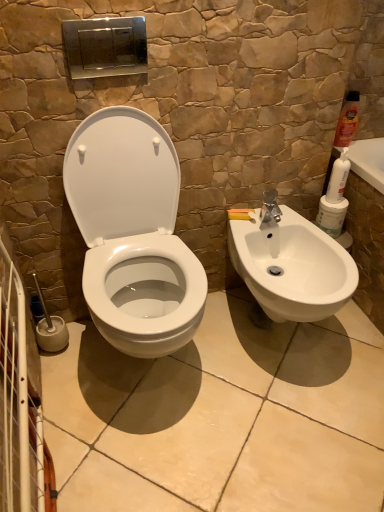
Question: From the image's perspective, does matte orange bottle at upper right, which is the first cleaning product from top to bottom, appear higher than white glossy toilet at center?

Choices:
 (A) yes
 (B) no

Answer: (A)

Question: Is matte orange bottle at upper right, the 2th cleaning product when ordered from bottom to top, at the left side of white glossy toilet at center?

Choices:
 (A) no
 (B) yes

Answer: (A)

Question: From a real-world perspective, is matte orange bottle at upper right, the 2th cleaning product when ordered from bottom to top, positioned over white glossy toilet at center based on gravity?

Choices:
 (A) no
 (B) yes

Answer: (B)

Question: From a real-world perspective, is matte orange bottle at upper right, the 1th cleaning product viewed from the right, below white glossy toilet at center?

Choices:
 (A) yes
 (B) no

Answer: (B)

Question: Is matte orange bottle at upper right, the 2th cleaning product when ordered from bottom to top, aimed at white glossy toilet at center?

Choices:
 (A) no
 (B) yes

Answer: (A)

Question: Does matte orange bottle at upper right, which is the first cleaning product from top to bottom, touch white glossy toilet at center?

Choices:
 (A) no
 (B) yes

Answer: (A)

Question: Can we say white matte cleaning product at right, arranged as the first cleaning product when viewed from the left, lies outside matte orange bottle at upper right, which is the first cleaning product from top to bottom?

Choices:
 (A) yes
 (B) no

Answer: (A)

Question: From a real-world perspective, does white matte cleaning product at right, the 2th cleaning product viewed from the right, sit lower than matte orange bottle at upper right, the second cleaning product viewed from the left?

Choices:
 (A) yes
 (B) no

Answer: (A)

Question: Does white matte cleaning product at right, the 2th cleaning product viewed from the right, have a smaller size compared to matte orange bottle at upper right, the 2th cleaning product when ordered from bottom to top?

Choices:
 (A) no
 (B) yes

Answer: (B)

Question: Is white matte cleaning product at right, the 2th cleaning product viewed from the right, at the right side of matte orange bottle at upper right, the second cleaning product viewed from the left?

Choices:
 (A) no
 (B) yes

Answer: (A)

Question: Does white matte cleaning product at right, positioned as the 2th cleaning product in top-to-bottom order, have a greater height compared to matte orange bottle at upper right, the 2th cleaning product when ordered from bottom to top?

Choices:
 (A) no
 (B) yes

Answer: (A)

Question: Can you confirm if white matte cleaning product at right, positioned as the 2th cleaning product in top-to-bottom order, is positioned to the left of matte orange bottle at upper right, the 2th cleaning product when ordered from bottom to top?

Choices:
 (A) no
 (B) yes

Answer: (B)

Question: Does matte orange bottle at upper right, the 2th cleaning product when ordered from bottom to top, have a greater width compared to white matte cleaning product at right, the first cleaning product ordered from the bottom?

Choices:
 (A) no
 (B) yes

Answer: (A)